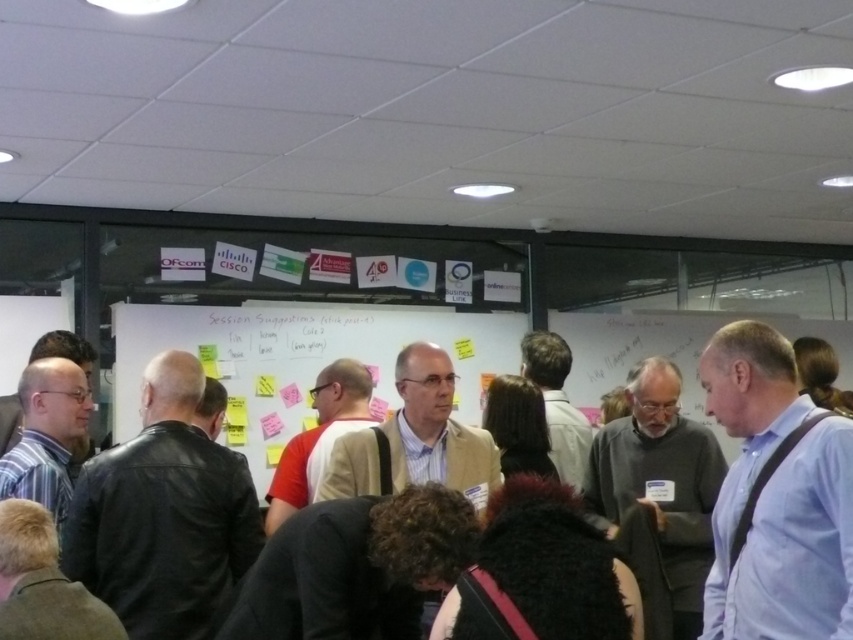
Question: Which point appears closest to the camera in this image?

Choices:
 (A) (363, 321)
 (B) (621, 362)

Answer: (A)

Question: Does white matte whiteboard at center come in front of dark brown leather jacket at center?

Choices:
 (A) no
 (B) yes

Answer: (B)

Question: Is blue shirt at center to the left of white matte whiteboard at center from the viewer's perspective?

Choices:
 (A) yes
 (B) no

Answer: (B)

Question: Observing the image, what is the correct spatial positioning of blue shirt at center in reference to dark brown leather jacket at center?

Choices:
 (A) left
 (B) right

Answer: (A)

Question: Which object is closer to the camera taking this photo?

Choices:
 (A) dark brown leather jacket at center
 (B) blue shirt at center
 (C) white matte whiteboard at center

Answer: (B)

Question: Which object appears farthest from the camera in this image?

Choices:
 (A) blue shirt at center
 (B) dark brown leather jacket at center
 (C) white matte whiteboard at center

Answer: (B)